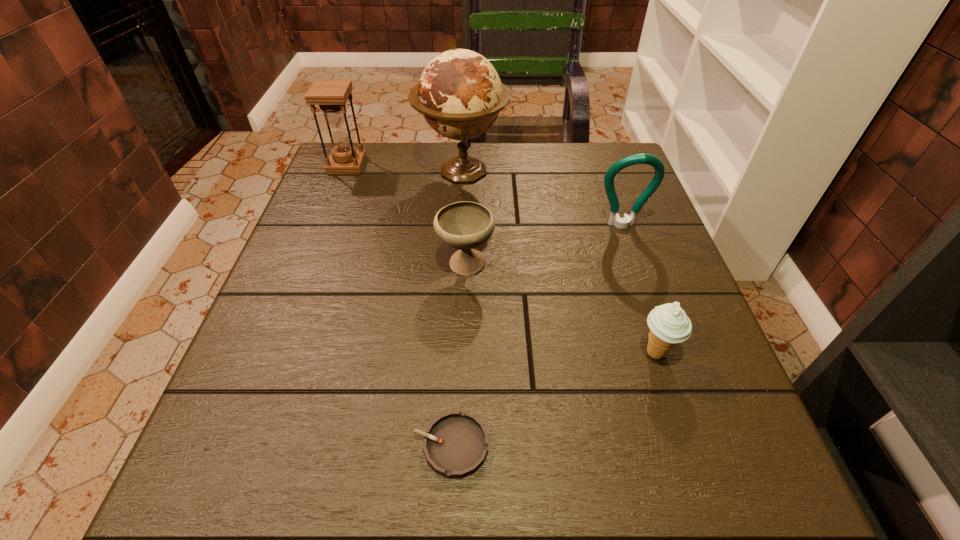
What are the coordinates of `vacant area that lies between the chalice and the nearest object` in the screenshot? It's located at (459, 355).

Identify the location of empty space between the tallest object and the ashtray. The width and height of the screenshot is (960, 540). (457, 308).

You are a GUI agent. You are given a task and a screenshot of the screen. Output one action in this format:
    pyautogui.click(x=<x>, y=<y>)
    Task: Click on the free spot between the icecream and the bottle opener
    
    Given the screenshot: What is the action you would take?
    pyautogui.click(x=638, y=289)

This screenshot has width=960, height=540. What are the coordinates of `unoccupied position between the globe and the shortest object` in the screenshot? It's located at (457, 308).

This screenshot has height=540, width=960. I want to click on free spot between the tallest object and the icecream, so click(559, 262).

In order to click on object identified as the fourth closest to the tallest object in this screenshot , I will do `click(669, 325)`.

The image size is (960, 540). Find the location of `the fifth closest object relative to the leftmost object`. the fifth closest object relative to the leftmost object is located at coordinates (669, 325).

Find the location of a particular element. The image size is (960, 540). free space that satisfies the following two spatial constraints: 1. on the front of the nearest object showing Asia; 2. on the left side of the tallest object is located at coordinates (448, 446).

What are the coordinates of `free region that satisfies the following two spatial constraints: 1. on the front of the second nearest object showing Asia; 2. on the left side of the globe` in the screenshot? It's located at (453, 353).